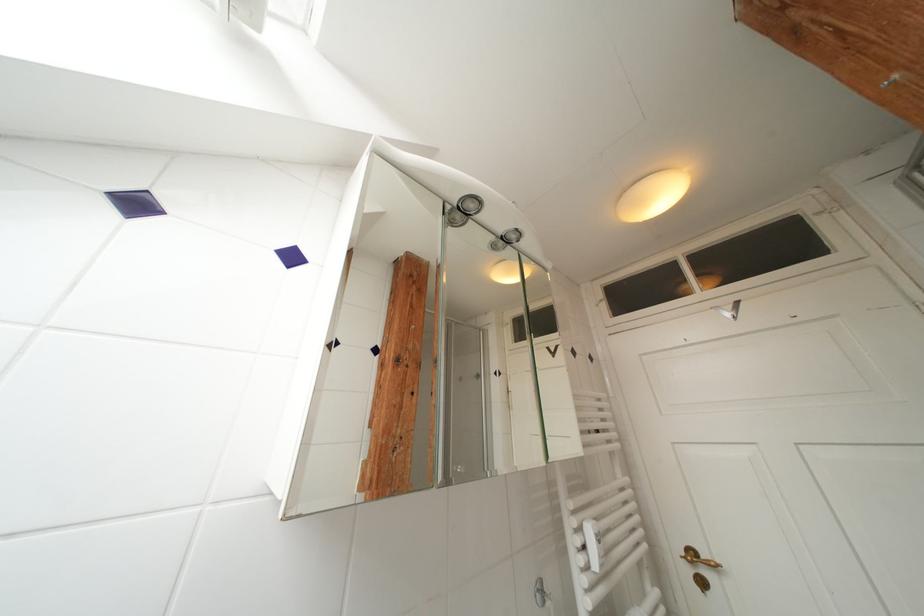
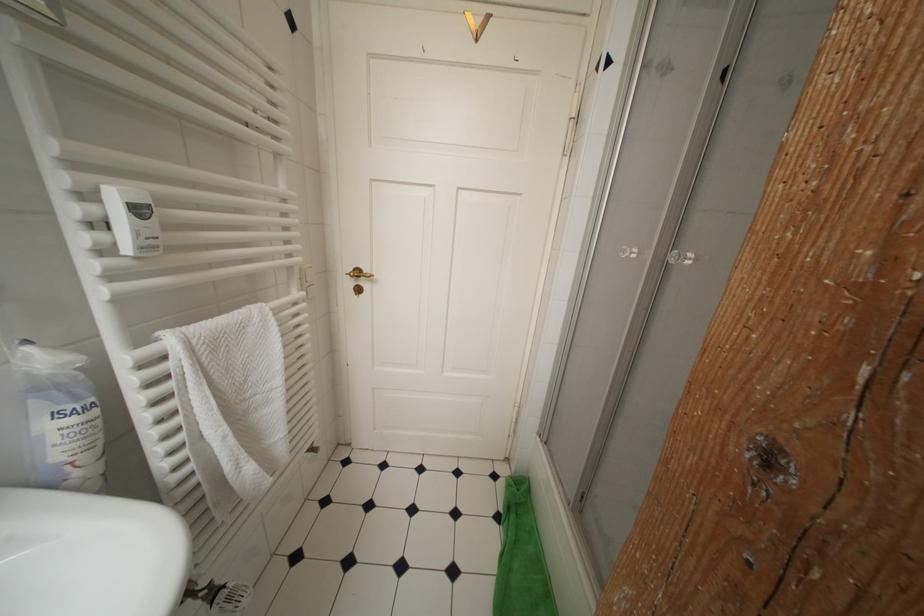
Based on the continuous images, in which direction is the camera rotating?

The camera's rotation is toward right-down.